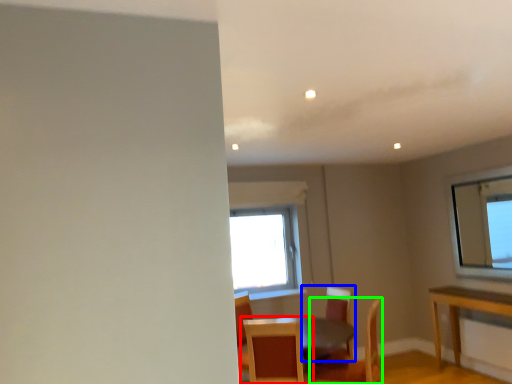
Question: Considering the real-world distances, which object is farthest from chair (highlighted by a red box)? chair (highlighted by a blue box) or chair (highlighted by a green box)?

Choices:
 (A) chair
 (B) chair

Answer: (B)